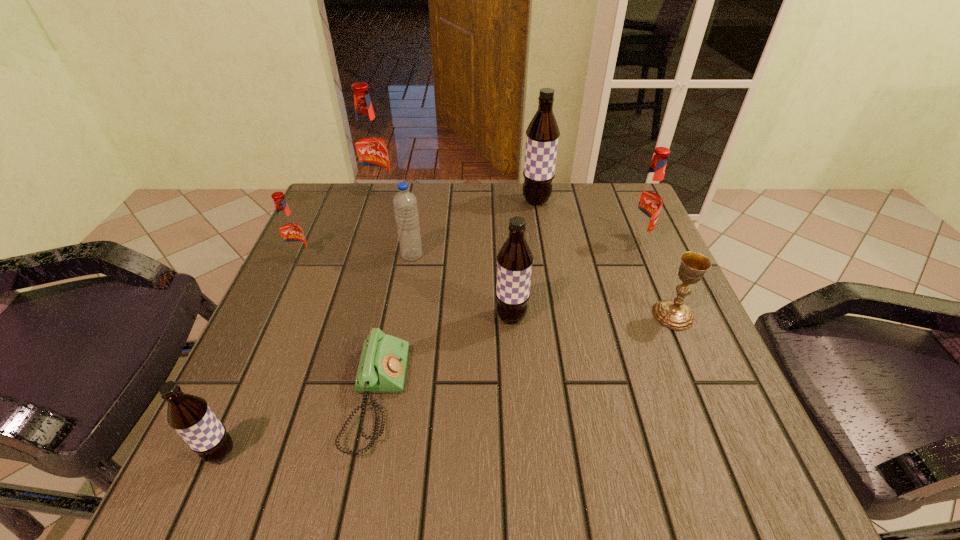
Point out which brown root beer is positioned as the third nearest to the smallest red root beer. Please provide its 2D coordinates. Your answer should be formatted as a tuple, i.e. [(x, y)], where the tuple contains the x and y coordinates of a point satisfying the conditions above.

[(542, 135)]

Image resolution: width=960 pixels, height=540 pixels. What are the coordinates of `red root beer that is the nearest to the leftmost brown root beer` in the screenshot? It's located at (290, 232).

What are the coordinates of `the second closest red root beer relative to the nearest brown root beer` in the screenshot? It's located at (370, 146).

Locate an element on the screen. This screenshot has height=540, width=960. free space that satisfies the following two spatial constraints: 1. on the front side of the third root beer from left to right; 2. on the left side of the second nearest red root beer is located at coordinates (365, 239).